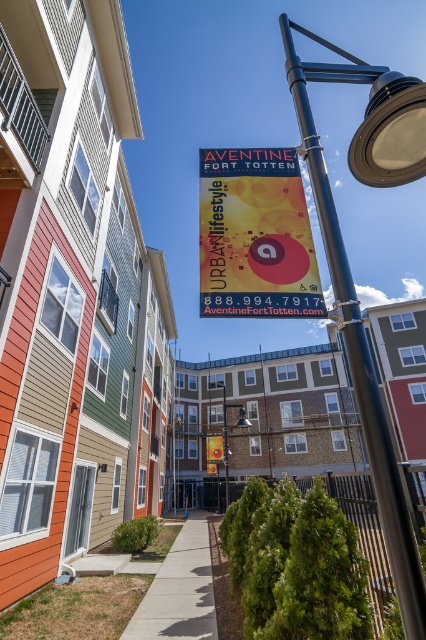
Does black metal pole at upper right have a smaller size compared to metallic pole at center?

Yes.

Who is higher up, black metal pole at upper right or metallic pole at center?

black metal pole at upper right is above.

I want to click on black metal pole at upper right, so click(x=360, y=369).

Between yellow fabric sign at center and black metal pole at upper right, which one has more height?

Standing taller between the two is yellow fabric sign at center.

Which of these two, yellow fabric sign at center or black metal pole at upper right, stands shorter?

Standing shorter between the two is black metal pole at upper right.

The image size is (426, 640). What do you see at coordinates (256, 236) in the screenshot?
I see `yellow fabric sign at center` at bounding box center [256, 236].

This screenshot has width=426, height=640. Identify the location of yellow fabric sign at center. (256, 236).

Does gray concrete sidewalk at center have a lesser height compared to metallic pole at center?

Yes, gray concrete sidewalk at center is shorter than metallic pole at center.

Can you confirm if gray concrete sidewalk at center is positioned to the right of metallic pole at center?

Incorrect, gray concrete sidewalk at center is not on the right side of metallic pole at center.

Where is `gray concrete sidewalk at center`? This screenshot has height=640, width=426. gray concrete sidewalk at center is located at coordinates (180, 592).